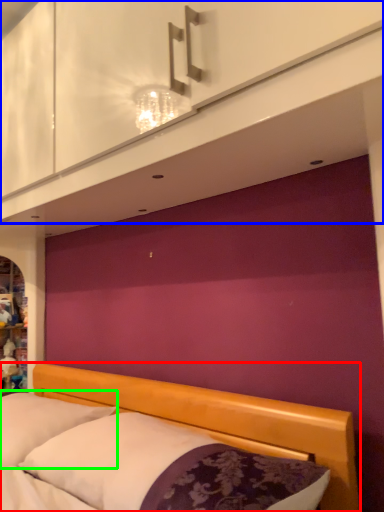
Question: Which is farther away from bed (highlighted by a red box)? dresser (highlighted by a blue box) or pillow (highlighted by a green box)?

Choices:
 (A) dresser
 (B) pillow

Answer: (A)